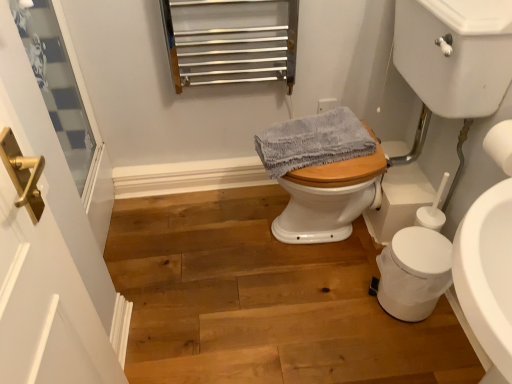
What do you see at coordinates (313, 142) in the screenshot? This screenshot has height=384, width=512. I see `gray textured towel at center` at bounding box center [313, 142].

In order to click on gray textured towel at center in this screenshot , I will do `click(313, 142)`.

The height and width of the screenshot is (384, 512). What do you see at coordinates (46, 251) in the screenshot?
I see `white glass screen door at left` at bounding box center [46, 251].

Describe the element at coordinates (57, 85) in the screenshot. I see `clear glass door handle at left` at that location.

The width and height of the screenshot is (512, 384). In order to click on clear glass door handle at left in this screenshot , I will do `click(57, 85)`.

Find the location of a particular element. The image size is (512, 384). wooden floor at center is located at coordinates point(263,300).

Does white matte toilet paper at right come behind wooden floor at center?

No, white matte toilet paper at right is in front of wooden floor at center.

Does white matte toilet paper at right appear on the left side of wooden floor at center?

No.

Is white matte toilet paper at right facing away from wooden floor at center?

No, wooden floor at center is not at the back of white matte toilet paper at right.

Can you confirm if white matte toilet paper at right is thinner than wooden floor at center?

Correct, the width of white matte toilet paper at right is less than that of wooden floor at center.

From the image's perspective, is gray textured towel at center located beneath white matte trash can at lower right?

No.

Does point (371, 137) come farther from viewer compared to point (425, 295)?

Yes, it is behind point (425, 295).

Which is more to the right, gray textured towel at center or white matte trash can at lower right?

Positioned to the right is white matte trash can at lower right.

Consider the image. Is gray textured towel at center not near white matte trash can at lower right?

No, there isn't a large distance between gray textured towel at center and white matte trash can at lower right.

Is clear glass door handle at left turned away from white glass screen door at left?

No.

Is clear glass door handle at left situated inside white glass screen door at left or outside?

clear glass door handle at left is not inside white glass screen door at left, it's outside.

Considering the sizes of clear glass door handle at left and white glass screen door at left in the image, is clear glass door handle at left bigger or smaller than white glass screen door at left?

Clearly, clear glass door handle at left is smaller in size than white glass screen door at left.

Is white glass screen door at left taller than clear glass door handle at left?

Yes, white glass screen door at left is taller than clear glass door handle at left.

How distant is white glass screen door at left from clear glass door handle at left?

The distance of white glass screen door at left from clear glass door handle at left is 72.52 centimeters.

Can you tell me how much white glass screen door at left and clear glass door handle at left differ in facing direction?

2.85 degrees separate the facing orientations of white glass screen door at left and clear glass door handle at left.

Does white glass screen door at left have a larger size compared to clear glass door handle at left?

Indeed, white glass screen door at left has a larger size compared to clear glass door handle at left.

Image resolution: width=512 pixels, height=384 pixels. I want to click on bath towel below the clear glass door handle at left (from the image's perspective), so click(313, 142).

From the image's perspective, relative to gray textured towel at center, is clear glass door handle at left above or below?

From the image's perspective, clear glass door handle at left appears above gray textured towel at center.

Is clear glass door handle at left not inside gray textured towel at center?

Yes.

Is clear glass door handle at left taller than gray textured towel at center?

Yes, clear glass door handle at left is taller than gray textured towel at center.

In the scene shown: From a real-world perspective, who is located higher, wooden floor at center or clear glass door handle at left?

clear glass door handle at left, from a real-world perspective.

Are wooden floor at center and clear glass door handle at left beside each other?

No, wooden floor at center is not with clear glass door handle at left.

Between wooden floor at center and clear glass door handle at left, which one has larger width?

With larger width is wooden floor at center.

Locate an element on the screen. The height and width of the screenshot is (384, 512). stair on the right side of clear glass door handle at left is located at coordinates (263, 300).

From a real-world perspective, which is physically below, white glass screen door at left or white matte trash can at lower right?

In real-world perspective, white matte trash can at lower right is lower.

Is the position of white glass screen door at left more distant than that of white matte trash can at lower right?

No, the depth of white glass screen door at left is less than that of white matte trash can at lower right.

Which point is more forward, (8, 98) or (381, 289)?

The point (8, 98) is in front.

From the image's perspective, between white glass screen door at left and white matte trash can at lower right, who is located below?

white matte trash can at lower right.

What are the coordinates of `toilet paper above the wooden floor at center (from a real-world perspective)` in the screenshot? It's located at (500, 145).

Locate an element on the screen. This screenshot has width=512, height=384. porcelain below the gray textured towel at center (from the image's perspective) is located at coordinates (414, 273).

Estimate the real-world distances between objects in this image. Which object is closer to white matte toilet paper at right, clear glass door handle at left or wooden floor at center?

The object closer to white matte toilet paper at right is wooden floor at center.

In the scene shown: Which object lies nearer to the anchor point white glass screen door at left, white glossy sink at center right or white matte trash can at lower right?

white matte trash can at lower right is closer to white glass screen door at left.

Looking at the image, which one is located closer to white matte toilet paper at right, wooden floor at center or white matte trash can at lower right?

Based on the image, white matte trash can at lower right appears to be nearer to white matte toilet paper at right.

From the image, which object appears to be nearer to gray textured towel at center, wooden floor at center or white matte toilet paper at right?

The object closer to gray textured towel at center is wooden floor at center.

When comparing their distances from white matte toilet paper at right, does wooden floor at center or gray textured towel at center seem closer?

Based on the image, gray textured towel at center appears to be nearer to white matte toilet paper at right.

Estimate the real-world distances between objects in this image. Which object is further from clear glass door handle at left, gray textured towel at center or wooden floor at center?

gray textured towel at center is positioned further to the anchor clear glass door handle at left.

Looking at this image, looking at the image, which one is located further to wooden floor at center, white glass screen door at left or white glossy sink at center right?

white glossy sink at center right is positioned further to the anchor wooden floor at center.

From the image, which object appears to be nearer to white matte toilet paper at right, white glossy sink at center right or gray textured towel at center?

white glossy sink at center right.

Find the location of a particular element. bath towel situated between clear glass door handle at left and white matte toilet paper at right from left to right is located at coordinates (313, 142).

Find the location of `stair between clear glass door handle at left and white matte trash can at lower right in the horizontal direction`. stair between clear glass door handle at left and white matte trash can at lower right in the horizontal direction is located at coordinates (263, 300).

Locate an element on the screen. Image resolution: width=512 pixels, height=384 pixels. toilet paper that lies between white glossy sink at center right and white matte trash can at lower right from top to bottom is located at coordinates (500, 145).

Find the location of a particular element. This screenshot has height=384, width=512. toilet paper between white glass screen door at left and white matte trash can at lower right from front to back is located at coordinates (500, 145).